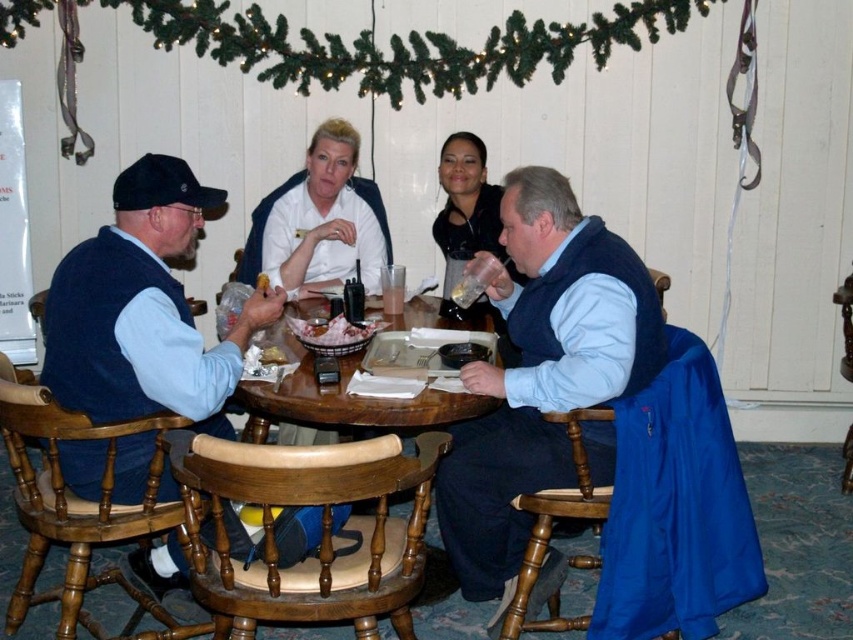
You are standing at the entrance of the room and want to place a small gift on the table. The gift must be placed exactly at point (332, 332). Where should you place the gift on the table?

The point (332, 332) is on the matte brown basket at center, so you should place the gift on the matte brown basket at center.

You are a photographer trying to capture a closeup of the white smooth shirt at center and the matte brown basket at center. Which object should you focus on first to ensure it appears sharp in your photo?

The white smooth shirt at center is closer to the viewer than the matte brown basket at center, so you should focus on the white smooth shirt at center first to ensure it appears sharp.